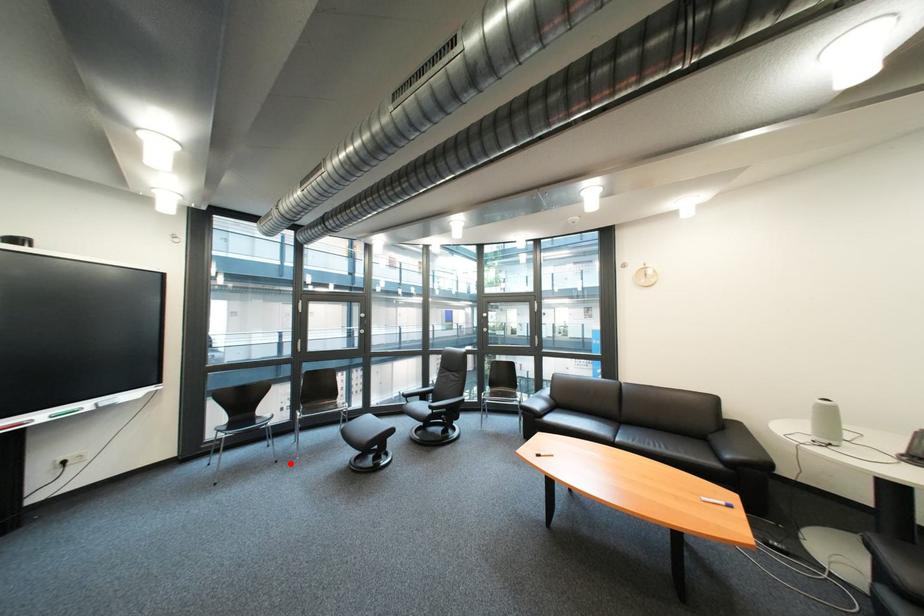
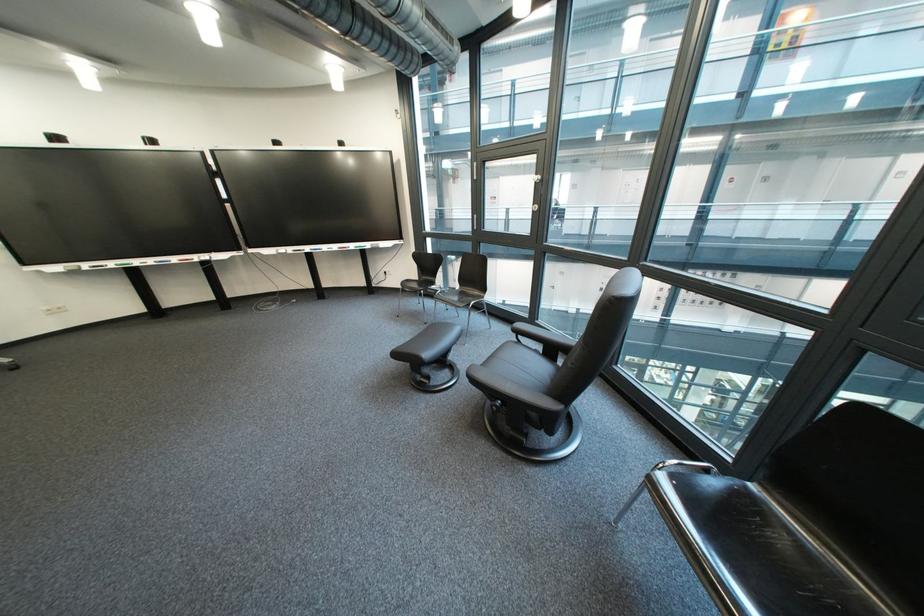
The point at the highlighted location is marked in the first image. Where is the corresponding point in the second image?

(439, 325)